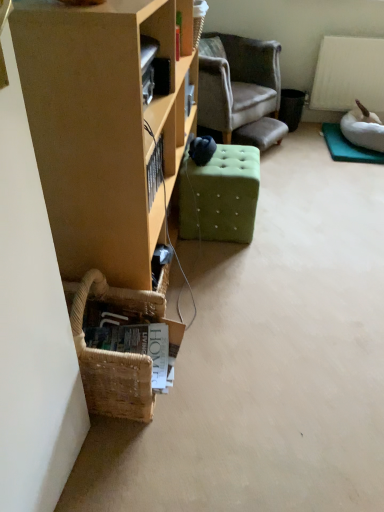
What is the approximate width of green tufted ottoman at center?

It is 15.39 inches.

Locate an element on the screen. woven brown basket at lower left is located at coordinates (116, 352).

Find the location of a particular element. matte wood cabinet at left is located at coordinates (103, 131).

Is green tufted ottoman at center further to the viewer compared to woven brown basket at lower left?

Yes, the depth of green tufted ottoman at center is greater than that of woven brown basket at lower left.

Who is smaller, green tufted ottoman at center or woven brown basket at lower left?

woven brown basket at lower left.

Can you confirm if green tufted ottoman at center is shorter than woven brown basket at lower left?

No, green tufted ottoman at center is not shorter than woven brown basket at lower left.

Is green tufted ottoman at center to the left or to the right of woven brown basket at lower left in the image?

Based on their positions, green tufted ottoman at center is located to the right of woven brown basket at lower left.

The image size is (384, 512). I want to click on stool that is on the right side of matte wood cabinet at left, so click(x=220, y=195).

Between matte wood cabinet at left and green tufted ottoman at center, which one appears on the left side from the viewer's perspective?

From the viewer's perspective, matte wood cabinet at left appears more on the left side.

From the image's perspective, which is above, matte wood cabinet at left or green tufted ottoman at center?

matte wood cabinet at left appears higher in the image.

Is matte wood cabinet at left positioned before green tufted ottoman at center?

Yes, matte wood cabinet at left is in front of green tufted ottoman at center.

Can you tell me how much matte wood cabinet at left and woven brown basket at lower left differ in facing direction?

They differ by 0.325 degrees in their facing directions.

Measure the distance from matte wood cabinet at left to woven brown basket at lower left.

matte wood cabinet at left is 12.78 inches from woven brown basket at lower left.

Is matte wood cabinet at left oriented towards woven brown basket at lower left?

No, matte wood cabinet at left does not turn towards woven brown basket at lower left.

Based on the photo, from the image's perspective, is matte wood cabinet at left beneath woven brown basket at lower left?

Actually, matte wood cabinet at left appears above woven brown basket at lower left in the image.

Is velvet gray armchair at center outside of woven brown basket at lower left?

That's correct, velvet gray armchair at center is outside of woven brown basket at lower left.

Considering the sizes of objects velvet gray armchair at center and woven brown basket at lower left in the image provided, who is bigger, velvet gray armchair at center or woven brown basket at lower left?

With larger size is velvet gray armchair at center.

From the picture: From a real-world perspective, which is physically below, velvet gray armchair at center or woven brown basket at lower left?

woven brown basket at lower left, from a real-world perspective.

Is velvet gray armchair at center to the left or to the right of woven brown basket at lower left in the image?

velvet gray armchair at center is to the right of woven brown basket at lower left.

Identify the location of cabinetry in front of the velvet gray armchair at center. (103, 131).

From the image's perspective, is matte wood cabinet at left above or below velvet gray armchair at center?

Based on their image positions, matte wood cabinet at left is located beneath velvet gray armchair at center.

Is point (67, 103) positioned before point (205, 96)?

Yes, point (67, 103) is in front of point (205, 96).

Does matte wood cabinet at left have a lesser width compared to velvet gray armchair at center?

Correct, the width of matte wood cabinet at left is less than that of velvet gray armchair at center.

Is velvet gray armchair at center completely or partially outside of green tufted ottoman at center?

Yes.

Which object is more forward, velvet gray armchair at center or green tufted ottoman at center?

green tufted ottoman at center is in front.

Is velvet gray armchair at center wider than green tufted ottoman at center?

Yes, velvet gray armchair at center is wider than green tufted ottoman at center.

From the image's perspective, is velvet gray armchair at center above or below green tufted ottoman at center?

Based on their image positions, velvet gray armchair at center is located above green tufted ottoman at center.

Is woven brown basket at lower left behind green tufted ottoman at center?

No.

Which of these two, woven brown basket at lower left or green tufted ottoman at center, is smaller?

Smaller between the two is woven brown basket at lower left.

Is woven brown basket at lower left wider or thinner than green tufted ottoman at center?

woven brown basket at lower left is thinner than green tufted ottoman at center.

At what (x,y) coordinates should I click in order to perform the action: click on basket that appears in front of the green tufted ottoman at center. Please return your answer as a coordinate pair (x, y). Looking at the image, I should click on (116, 352).

In order to click on cabinetry above the green tufted ottoman at center (from a real-world perspective) in this screenshot , I will do `click(103, 131)`.

Looking at the image, which one is located further to velvet gray armchair at center, matte wood cabinet at left or woven brown basket at lower left?

woven brown basket at lower left is further to velvet gray armchair at center.

Estimate the real-world distances between objects in this image. Which object is further from matte wood cabinet at left, velvet gray armchair at center or woven brown basket at lower left?

Based on the image, velvet gray armchair at center appears to be further to matte wood cabinet at left.

Estimate the real-world distances between objects in this image. Which object is further from matte wood cabinet at left, green tufted ottoman at center or woven brown basket at lower left?

green tufted ottoman at center lies further to matte wood cabinet at left than the other object.

From the image, which object appears to be nearer to velvet gray armchair at center, green tufted ottoman at center or matte wood cabinet at left?

The object closer to velvet gray armchair at center is green tufted ottoman at center.

When comparing their distances from green tufted ottoman at center, does matte wood cabinet at left or velvet gray armchair at center seem closer?

Based on the image, matte wood cabinet at left appears to be nearer to green tufted ottoman at center.

Estimate the real-world distances between objects in this image. Which object is further from green tufted ottoman at center, woven brown basket at lower left or matte wood cabinet at left?

The object further to green tufted ottoman at center is woven brown basket at lower left.

Which object lies nearer to the anchor point matte wood cabinet at left, green tufted ottoman at center or velvet gray armchair at center?

The object closer to matte wood cabinet at left is green tufted ottoman at center.

Looking at the image, which one is located further to woven brown basket at lower left, green tufted ottoman at center or velvet gray armchair at center?

Based on the image, velvet gray armchair at center appears to be further to woven brown basket at lower left.

Where is `basket located between matte wood cabinet at left and green tufted ottoman at center in the depth direction`? basket located between matte wood cabinet at left and green tufted ottoman at center in the depth direction is located at coordinates (116, 352).

Find the location of a particular element. This screenshot has height=512, width=384. basket located between matte wood cabinet at left and velvet gray armchair at center in the depth direction is located at coordinates click(116, 352).

I want to click on stool that lies between velvet gray armchair at center and woven brown basket at lower left from top to bottom, so click(x=220, y=195).

The width and height of the screenshot is (384, 512). Find the location of `stool between matte wood cabinet at left and velvet gray armchair at center from front to back`. stool between matte wood cabinet at left and velvet gray armchair at center from front to back is located at coordinates (220, 195).